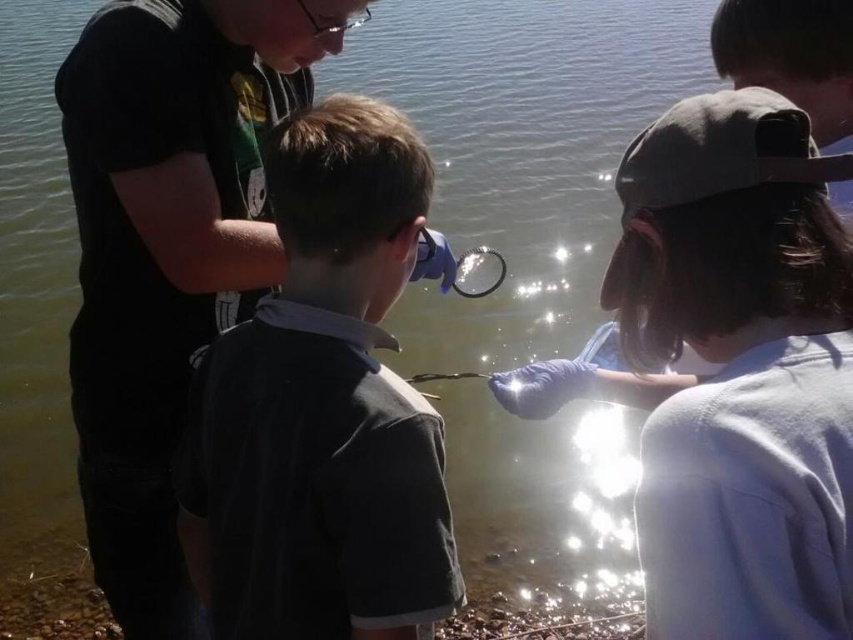
Question: Which object is positioned farthest from the transparent plastic magnifying glass at center?

Choices:
 (A) black matte shirt at left
 (B) light blue fabric at center

Answer: (B)

Question: Can you confirm if dark gray cotton shirt at center is smaller than transparent plastic magnifying glass at center?

Choices:
 (A) yes
 (B) no

Answer: (B)

Question: Is dark gray cotton shirt at center below black matte shirt at left?

Choices:
 (A) yes
 (B) no

Answer: (A)

Question: Does light blue fabric at center have a greater width compared to black matte shirt at left?

Choices:
 (A) yes
 (B) no

Answer: (B)

Question: Estimate the real-world distances between objects in this image. Which object is closer to the light blue fabric at center?

Choices:
 (A) dark gray cotton shirt at center
 (B) transparent plastic magnifying glass at center
 (C) black matte shirt at left

Answer: (A)

Question: Which object appears farthest from the camera in this image?

Choices:
 (A) dark gray cotton shirt at center
 (B) light blue fabric at center
 (C) transparent plastic magnifying glass at center
 (D) black matte shirt at left

Answer: (C)